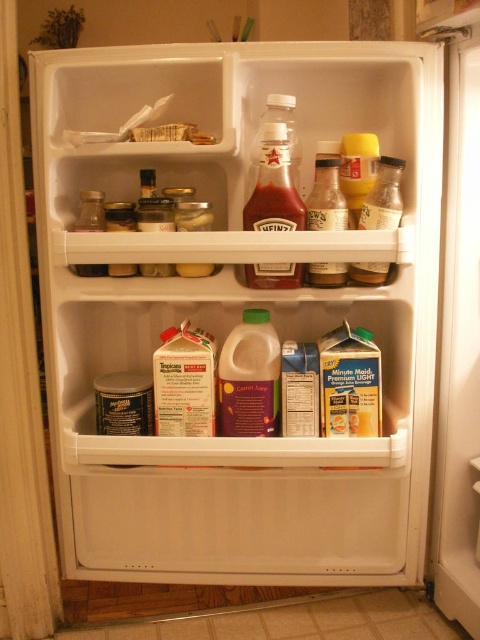
You are organizing the items in the refrigerator and need to place a new bottle of mayonnaise between the translucent glass jar at upper right and the yellow glossy mustard at upper right. Is there enough space between them to fit the mayonnaise bottle, which is 1.5 inches wide?

The space between the translucent glass jar at upper right and the yellow glossy mustard at upper right is 1.63 inches. Since the mayonnaise bottle is 1.5 inches wide, it can fit between them as there is sufficient space.

You are organizing the contents of the refrigerator and need to place a new jar of pickles. You have two options for placement spots on the refrigerator shelves. One is where the translucent glass jar at upper right is currently located, and the other is where the clear glass jar at center is. Which spot is closer to you if you are standing in front of the open refrigerator door?

The translucent glass jar at upper right is closer to the viewer than the clear glass jar at center, so the spot where the translucent glass jar at upper right is located is closer to you.

Based on the photo, you are trying to reach the items in the refrigerator. You can only extend your hand to a certain depth. If you focus on the two points inside the fridge labeled as point (397, 177) and point (361, 177), which point can you reach first without stretching your hand further into the fridge?

Point (397, 177) is closer to the camera than point (361, 177), so you can reach it first without stretching your hand further into the fridge.